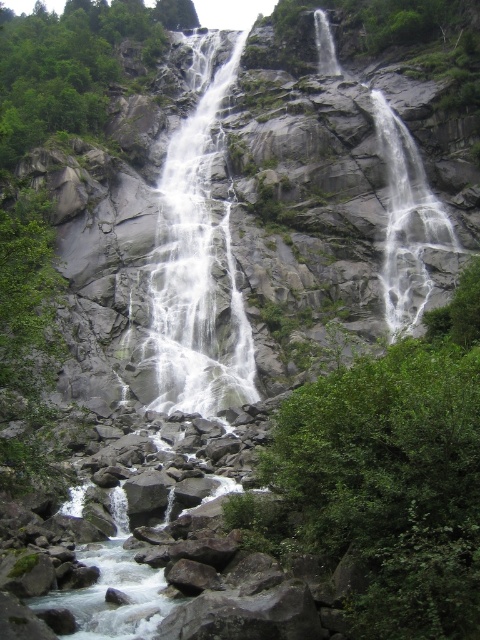
Question: Which of the following is the closest to the observer?

Choices:
 (A) (6, 154)
 (B) (394, 157)
 (C) (219, 288)
 (D) (476, 269)

Answer: (D)

Question: Can you confirm if green leafy tree at center is positioned to the left of white smooth waterfall at upper right?

Choices:
 (A) yes
 (B) no

Answer: (A)

Question: Which object is the closest to the green leafy tree at upper left?

Choices:
 (A) green leafy tree at center
 (B) white frothy water at center

Answer: (B)

Question: Is green leafy tree at center closer to camera compared to white smooth waterfall at upper right?

Choices:
 (A) yes
 (B) no

Answer: (A)

Question: Which object appears farthest from the camera in this image?

Choices:
 (A) green leafy tree at upper left
 (B) white frothy water at center

Answer: (A)

Question: Can you confirm if white frothy water at center is positioned above green leafy tree at upper left?

Choices:
 (A) no
 (B) yes

Answer: (A)